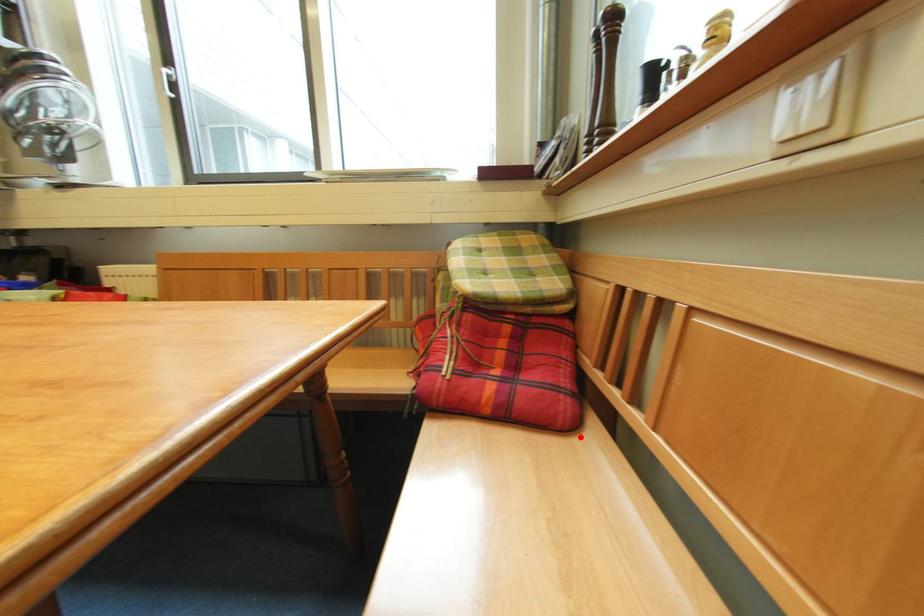
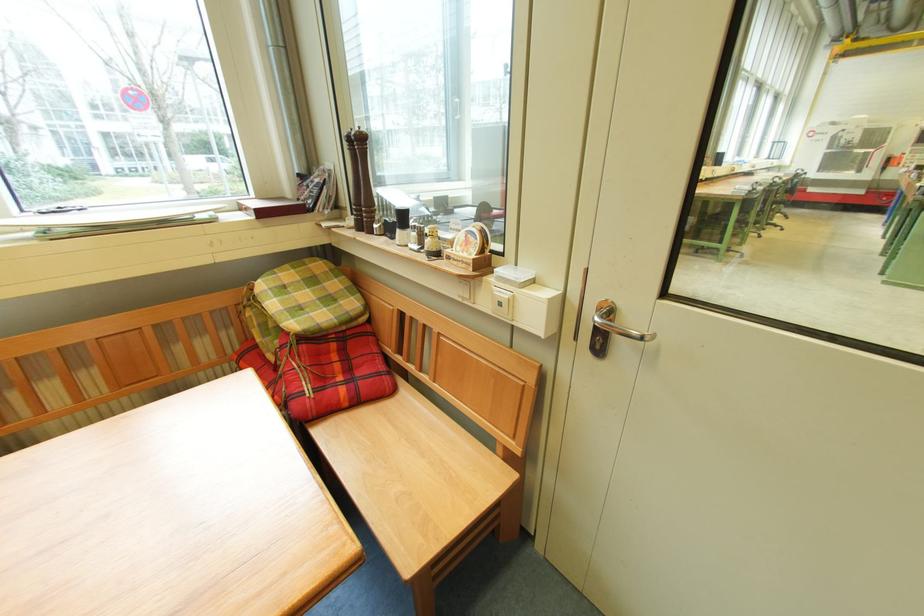
Question: A red point is marked in image1. In image2, is the corresponding 3D point closer to the camera or farther? Reply with the corresponding letter.

Choices:
 (A) The corresponding 3D point is closer.
 (B) The corresponding 3D point is farther.

Answer: (A)